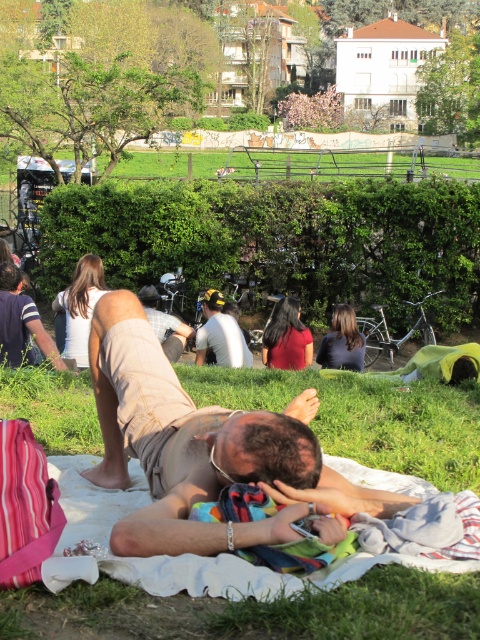
You are a photographer trying to capture a candid shot of the man in the scene. Since the tan cotton shorts at lower center is in front of the white matte shirt at center, will the shorts block the view of the shirt in the photo?

Yes, the tan cotton shorts at lower center is in front of the white matte shirt at center, so the shorts will block the view of the shirt in the photo.

You are standing at the edge of the park and see the tan cotton shorts at lower center and the white matte shirt at center. Which object is closer to you?

The tan cotton shorts at lower center is 20.01 feet away from the white matte shirt at center, so the white matte shirt at center is closer to you.